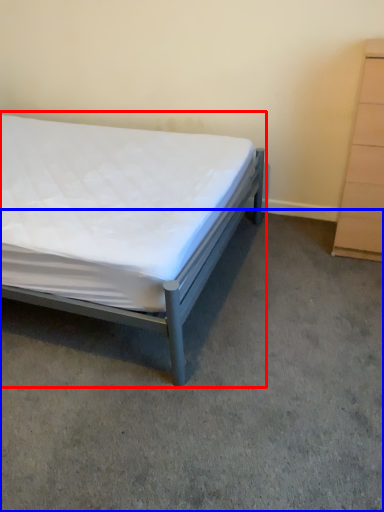
Question: Which of the following is the farthest to the observer, bed (highlighted by a red box) or concrete (highlighted by a blue box)?

Choices:
 (A) bed
 (B) concrete

Answer: (A)